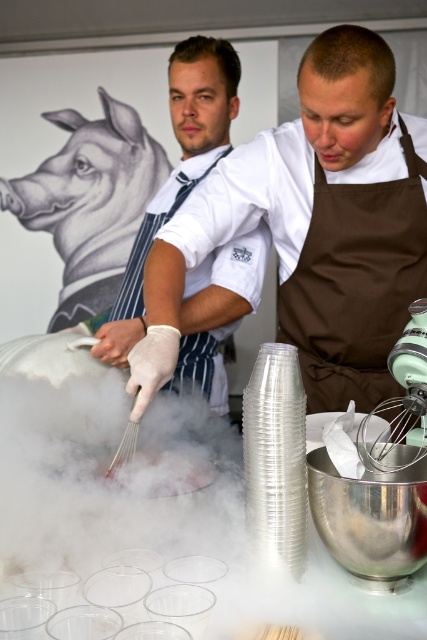
Question: Which is nearer to the white wire whisk at center?

Choices:
 (A) metallic silver mixing bowl at center
 (B) white striped apron at center

Answer: (A)

Question: Where is white matte glove at left located in relation to metallic silver mixing bowl at center in the image?

Choices:
 (A) below
 (B) above

Answer: (B)

Question: Does white matte glove at left have a larger size compared to green plastic whisk at center?

Choices:
 (A) yes
 (B) no

Answer: (A)

Question: Which object is positioned farthest from the metallic silver mixing bowl at center?

Choices:
 (A) white wire whisk at center
 (B) white matte glove at left
 (C) green plastic whisk at center
 (D) white striped apron at center

Answer: (D)

Question: Estimate the real-world distances between objects in this image. Which object is closer to the metallic silver mixing bowl at center?

Choices:
 (A) green plastic whisk at center
 (B) white matte glove at left
 (C) white wire whisk at center

Answer: (A)

Question: Considering the relative positions of white striped apron at center and white wire whisk at center in the image provided, where is white striped apron at center located with respect to white wire whisk at center?

Choices:
 (A) above
 (B) below

Answer: (A)